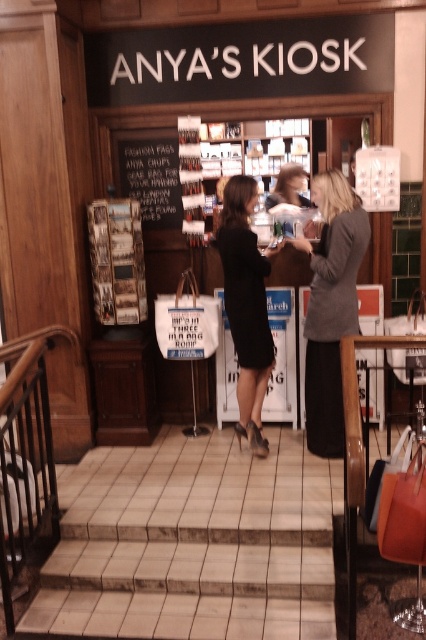
Does black satin dress at center come behind black chalkboard at center?

No.

Does black satin dress at center appear over black chalkboard at center?

No, black satin dress at center is not above black chalkboard at center.

Does point (253, 365) come farther from viewer compared to point (176, 227)?

No.

Locate an element on the screen. The width and height of the screenshot is (426, 640). black satin dress at center is located at coordinates (247, 305).

Is gray wool sweater at center closer to the viewer compared to black chalkboard at center?

Yes, it is in front of black chalkboard at center.

What do you see at coordinates (331, 307) in the screenshot? I see `gray wool sweater at center` at bounding box center [331, 307].

This screenshot has height=640, width=426. Describe the element at coordinates (331, 307) in the screenshot. I see `gray wool sweater at center` at that location.

In order to click on gray wool sweater at center in this screenshot , I will do `click(331, 307)`.

Which is more to the left, gray wool sweater at center or black satin dress at center?

black satin dress at center

Find the location of a particular element. The height and width of the screenshot is (640, 426). gray wool sweater at center is located at coordinates (331, 307).

Is point (347, 243) behind point (261, 428)?

No.

Locate an element on the screen. gray wool sweater at center is located at coordinates pyautogui.click(x=331, y=307).